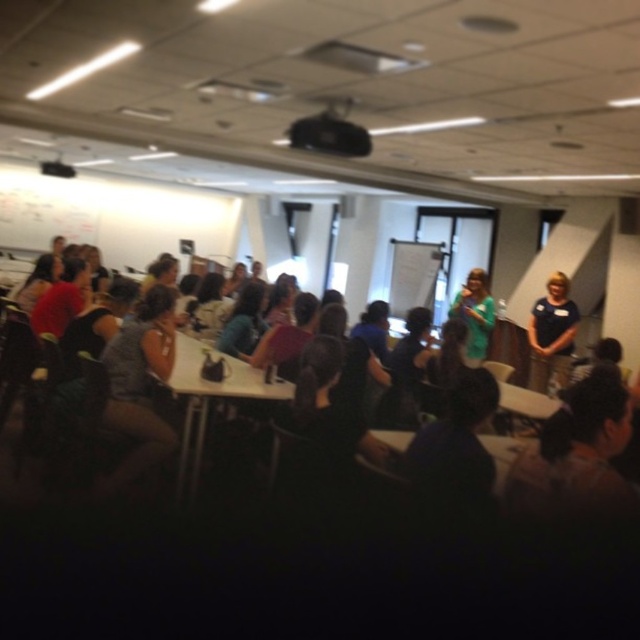
Between white paperboard at center and black plastic projector at upper center, which one has more height?

white paperboard at center is taller.

Is point (435, 248) farther from viewer compared to point (307, 145)?

Yes, point (435, 248) is farther from viewer.

Where is `white paperboard at center`? white paperboard at center is located at coordinates (413, 275).

Can you confirm if white paperboard at center is positioned to the right of green fabric dress at center?

No, white paperboard at center is not to the right of green fabric dress at center.

Does white paperboard at center have a greater width compared to green fabric dress at center?

Correct, the width of white paperboard at center exceeds that of green fabric dress at center.

Between point (417, 301) and point (470, 323), which one is positioned behind?

The point (417, 301) is behind.

Locate an element on the screen. Image resolution: width=640 pixels, height=640 pixels. white paperboard at center is located at coordinates (413, 275).

Which is more to the right, blue fabric shirt at center or white paperboard at center?

blue fabric shirt at center is more to the right.

Is blue fabric shirt at center further to the viewer compared to white paperboard at center?

No, it is not.

Does point (540, 323) come behind point (406, 248)?

No, (540, 323) is in front of (406, 248).

Locate an element on the screen. Image resolution: width=640 pixels, height=640 pixels. blue fabric shirt at center is located at coordinates (552, 333).